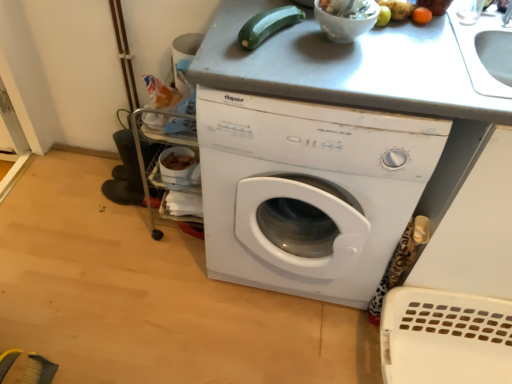
Question: Considering the positions of orange matte fruit at upper right, the second vegetable from the left, and green matte zucchini at upper center, the 2th vegetable from the right, in the image, is orange matte fruit at upper right, the second vegetable from the left, taller or shorter than green matte zucchini at upper center, the 2th vegetable from the right,?

Choices:
 (A) short
 (B) tall

Answer: (A)

Question: Is orange matte fruit at upper right, the 1th vegetable when ordered from right to left, spatially inside green matte zucchini at upper center, the 2th vegetable from the right, or outside of it?

Choices:
 (A) outside
 (B) inside

Answer: (A)

Question: Based on their relative distances, which object is nearer to the white glossy bowl at upper center?

Choices:
 (A) white plastic washing machine at center
 (B) green matte zucchini at upper center, the 2th vegetable from the right
 (C) orange matte fruit at upper right, the 1th vegetable when ordered from right to left
 (D) white glossy bowl at upper center

Answer: (D)

Question: Which object is the farthest from the white glossy bowl at upper center?

Choices:
 (A) white glossy bowl at upper center
 (B) white plastic washing machine at center
 (C) green matte zucchini at upper center, which ranks as the 1th vegetable in left-to-right order
 (D) orange matte fruit at upper right, the 1th vegetable when ordered from right to left

Answer: (B)